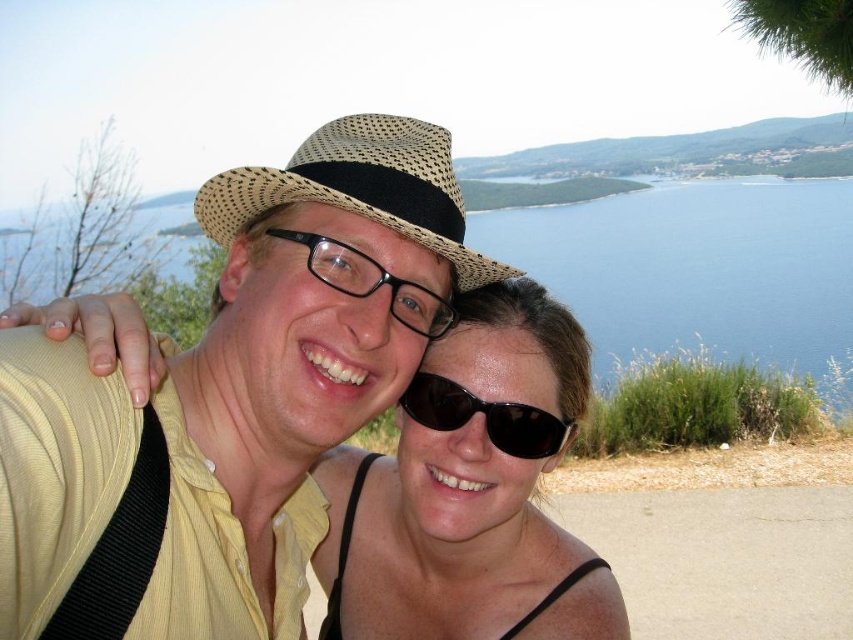
You are a photographer trying to capture a closeup of the natural straw hat at center and the black plastic sunglasses at center. Since both are at the center, which object should you zoom in on first to ensure it fills the frame without moving the camera?

The natural straw hat at center is bigger than black plastic sunglasses at center, so you should zoom in on the natural straw hat at center first to ensure it fills the frame without moving the camera.

You are a photographer trying to frame a shot of the two people in the image. The natural straw hat at center is located at coordinates 0.295, 0.423. If you want to ensure the hat is centered in your viewfinder, where should you position your camera? Please provide the coordinates as a pair of numbers between 0 and 1, where 0 is the bottom left corner and 1 is the top right corner.

To center the natural straw hat at center in the viewfinder, position the camera at coordinates (360, 188).

You are a photographer trying to capture a clear shot of both the natural straw hat at center and the black plastic glasses at center. Since the camera can only focus on one object at a time, which object should you focus on to ensure it appears sharp and in focus, considering their height difference?

The natural straw hat at center is much taller than the black plastic glasses at center, so focusing on the natural straw hat at center would ensure it appears sharp. However, since the height difference might mean they are at different distances, it would be best to focus on the closer object. But according to the description, the straw hat is taller, which typically means it is further away, so focusing on the black plastic glasses at center would keep the closer object sharp.